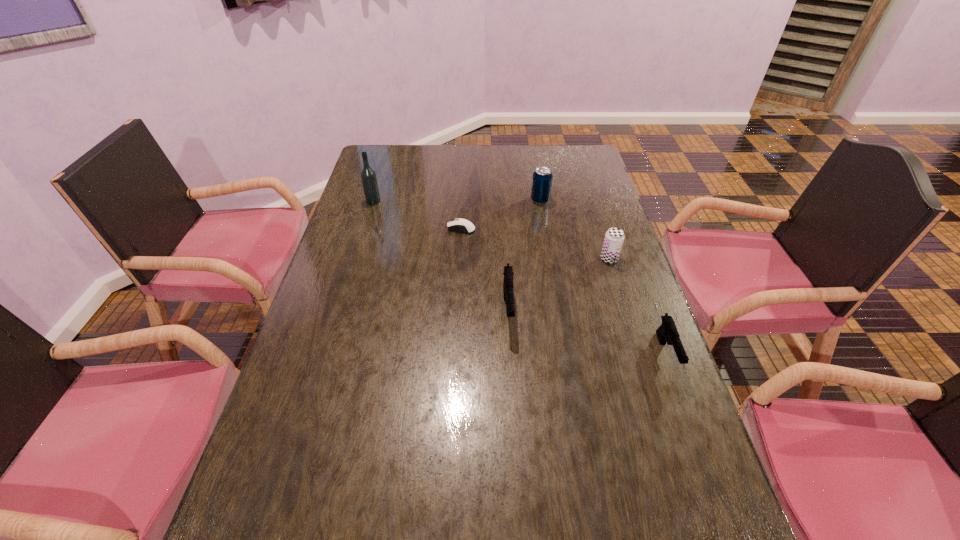
At what (x,y) coordinates should I click in order to perform the action: click on free space between the tallest object and the shorter pistol. Please return your answer as a coordinate pair (x, y). Looking at the image, I should click on (519, 278).

The image size is (960, 540). What are the coordinates of `vacant space that is in between the right pistol and the third object from right to left` in the screenshot? It's located at (603, 277).

This screenshot has width=960, height=540. Identify the location of free space that is in between the mouse and the rightmost object. (564, 291).

Find the location of a particular element. The height and width of the screenshot is (540, 960). free area in between the taller pistol and the right pistol is located at coordinates (588, 332).

Where is `free spot between the fourth object from right to left and the beer can`? The image size is (960, 540). free spot between the fourth object from right to left and the beer can is located at coordinates (559, 285).

The width and height of the screenshot is (960, 540). Identify the location of object that is the third nearest to the mouse. (368, 176).

Where is `object that is the third closest to the mouse`? This screenshot has width=960, height=540. object that is the third closest to the mouse is located at coordinates (368, 176).